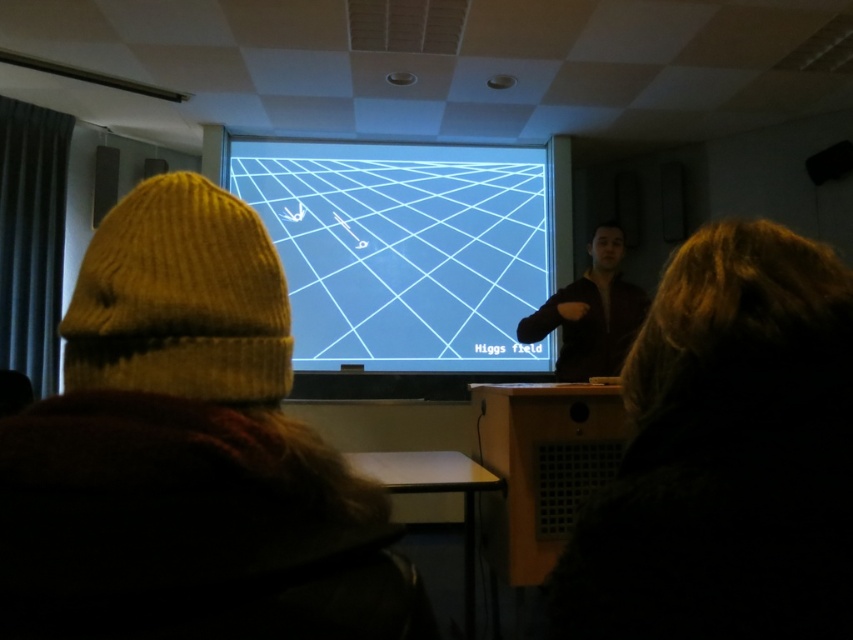
You are standing in the classroom and want to move to the front to ask a question about the Higgs field diagram. There is a dark brown fur coat at right in the way. Can you walk around it on the left side?

The dark brown fur coat at right is positioned at point 0.711 on the x axis and 0.853 on the y axis. Since it is at the right side of the room, you can walk around it on the left side to reach the front of the classroom.